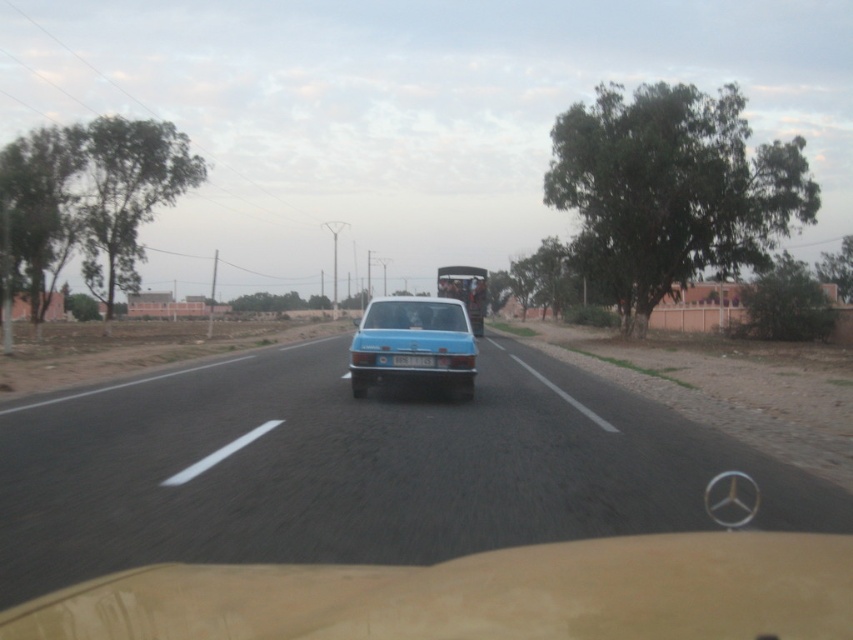
You are driving a car and want to check the license plate of the blue glossy car at center. Can you see the blue plastic license plate at center clearly from your current position?

The blue glossy car at center is closer to the viewer than the blue plastic license plate at center, so yes, the license plate is visible but might appear smaller due to distance.

You are driving a car and want to overtake the blue glossy car at center. The road ahead has a point marked at coordinates (357, 467) which indicates the position of the blue glossy car at center. Can you safely overtake the blue glossy car at center before reaching that point?

The point at coordinates (357, 467) indicates the position of the blue glossy car at center, so you cannot overtake it before reaching that point since the car is already at that location.

You are a driver in a car and you see the blue matte sedan at center and the blue plastic license plate at center ahead. Which object is wider?

The blue matte sedan at center is wider than the blue plastic license plate at center.